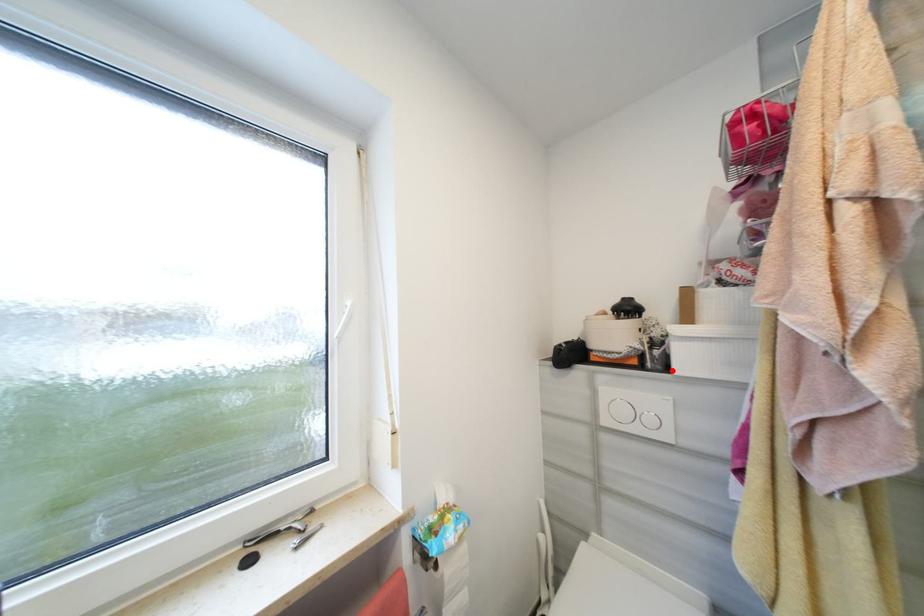
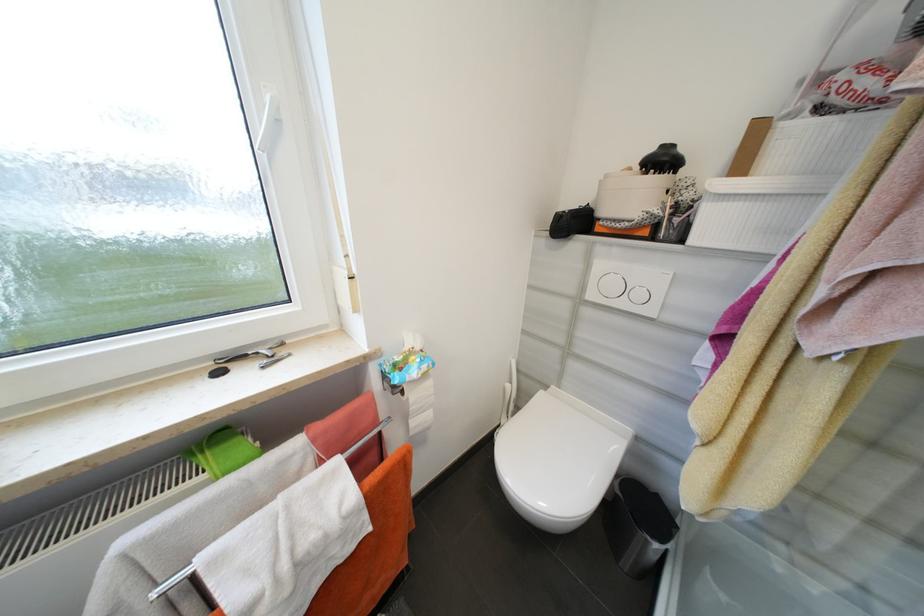
Find the pixel in the second image that matches the highlighted location in the first image.

(687, 241)